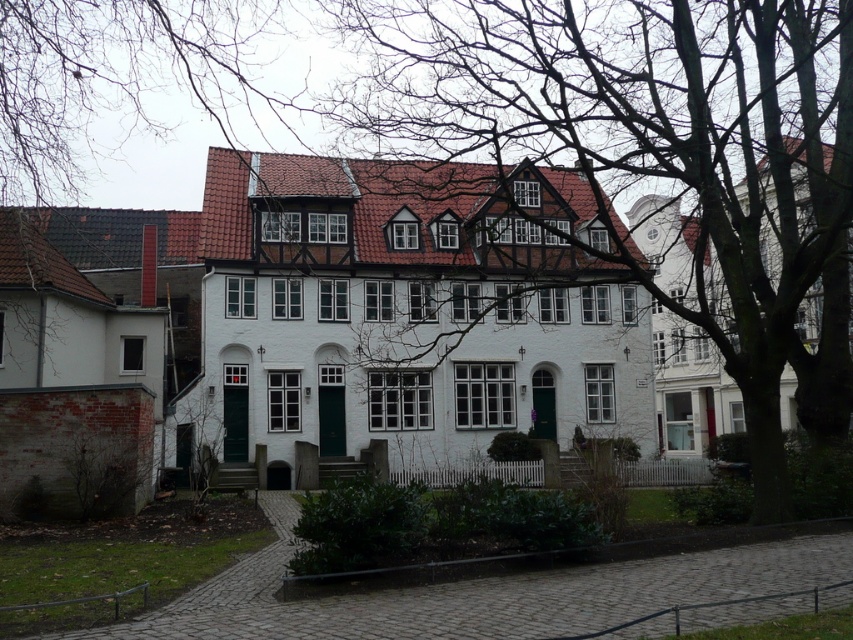
Does smooth bark tree at center have a greater width compared to bare branches at upper left?

Yes, smooth bark tree at center is wider than bare branches at upper left.

Which is in front, point (804, 20) or point (184, 74)?

Point (804, 20)

Which is in front, point (489, 26) or point (105, 22)?

Point (489, 26) is more forward.

Identify the location of smooth bark tree at center. (653, 144).